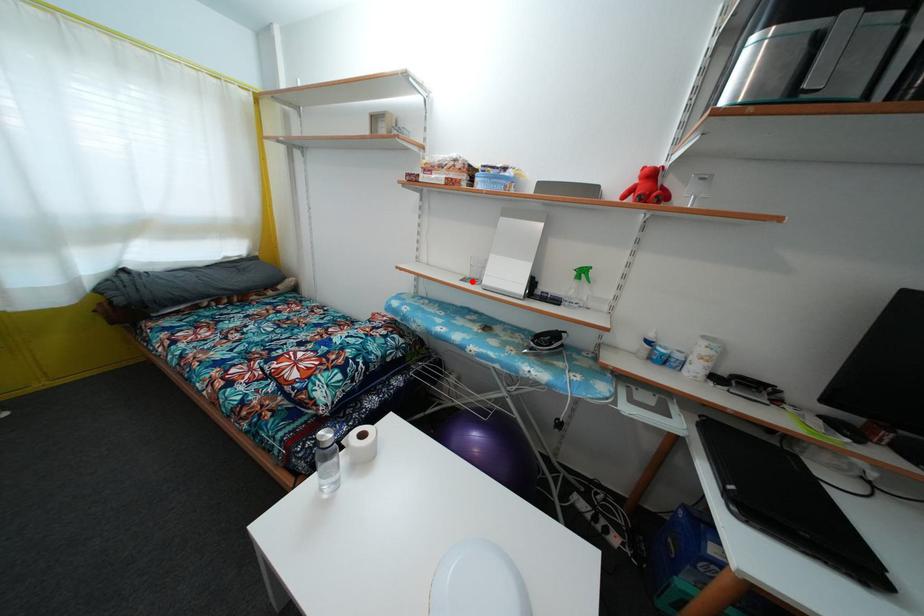
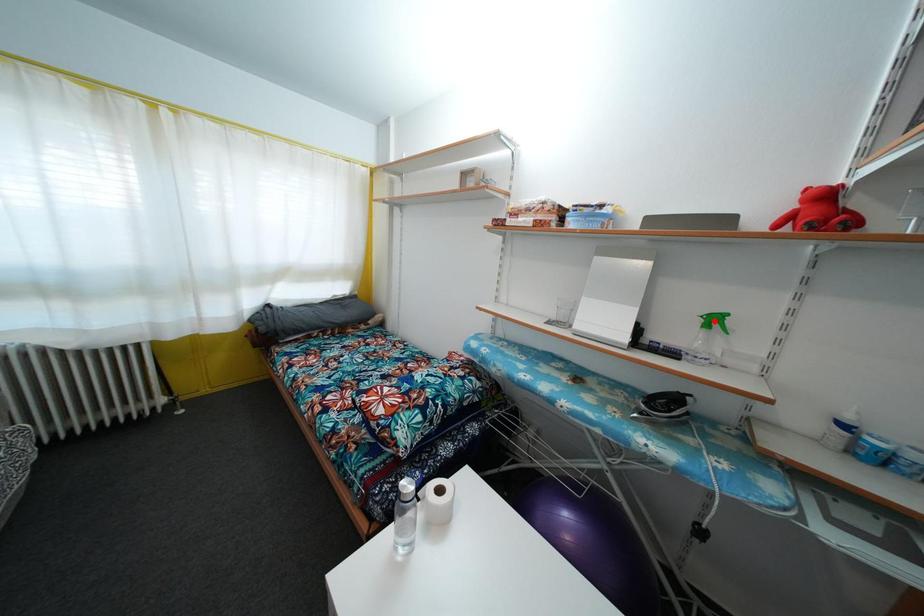
I am providing you with two images of the same scene from different viewpoints. A red point is marked on the first image and another point is marked on the second image. Is the red point in image1 aligned with the point shown in image2?

No